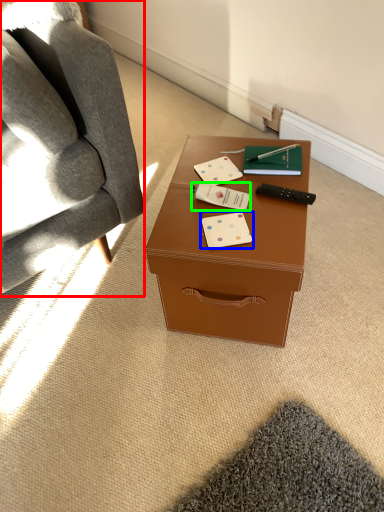
Question: Which object is positioned closest to chair (highlighted by a red box)? Select from business card (highlighted by a blue box) and business card (highlighted by a green box).

Choices:
 (A) business card
 (B) business card

Answer: (B)